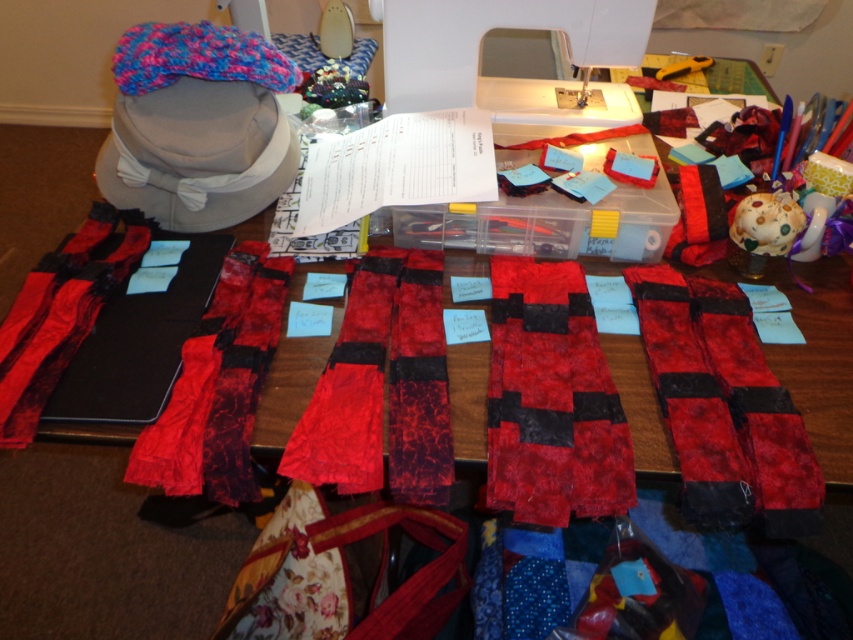
You are a tailor working on a project and need to reach both the textured fabric strips at center and the knitted wool headband at upper left. If your arm can extend 1.5 meters, can you comfortably reach both items without moving your chair?

The textured fabric strips at center is 1.38 meters away from the knitted wool headband at upper left. Since your arm can extend 1.5 meters, you can comfortably reach both items without moving your chair.

You are organizing the workspace and want to place the white plastic sewing machine at upper center on top of the textured fabric strips at center. Is the sewing machine too big to fit on the fabric strips?

The textured fabric strips at center has a larger size compared to the white plastic sewing machine at upper center, so the sewing machine should fit on top of the fabric strips since they are bigger than the sewing machine.

You are organizing a sewing kit and need to place the textured red fabric at center and the red velvet scarf at center into a storage box. Which item should you place first if you want to maximize vertical space in the box?

The textured red fabric at center is not as tall as the red velvet scarf at center, so you should place the taller red velvet scarf at center first to utilize vertical space more effectively.